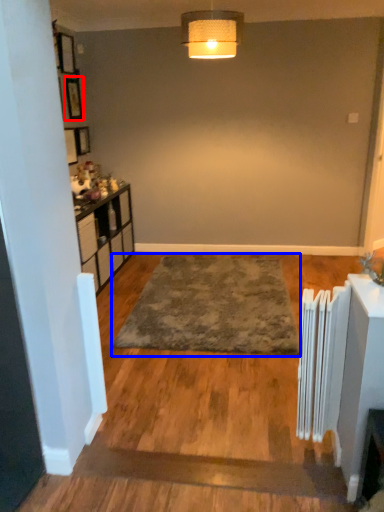
Question: Which of the following is the closest to the observer, picture frame (highlighted by a red box) or mat (highlighted by a blue box)?

Choices:
 (A) picture frame
 (B) mat

Answer: (B)